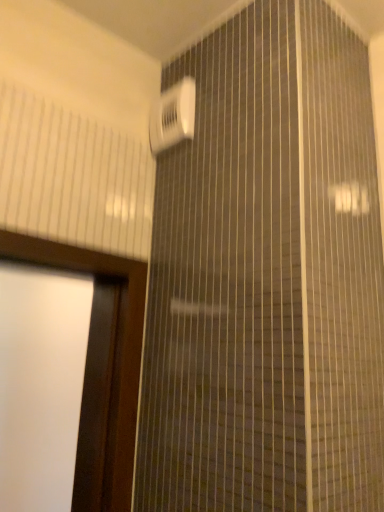
Locate an element on the screen. white plastic air conditioner at upper center is located at coordinates (173, 116).

Image resolution: width=384 pixels, height=512 pixels. What do you see at coordinates (173, 116) in the screenshot? I see `white plastic air conditioner at upper center` at bounding box center [173, 116].

This screenshot has width=384, height=512. In order to click on white plastic air conditioner at upper center in this screenshot , I will do `click(173, 116)`.